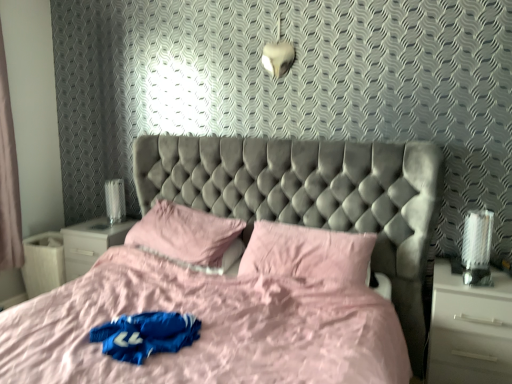
Question: Is white glossy nightstand at lower left, positioned as the first nightstand in left-to-right order, not inside pink fabric curtain at left?

Choices:
 (A) no
 (B) yes

Answer: (B)

Question: Is white glossy nightstand at lower left, positioned as the first nightstand in left-to-right order, positioned in front of pink fabric curtain at left?

Choices:
 (A) no
 (B) yes

Answer: (A)

Question: From the image's perspective, is white glossy nightstand at lower left, acting as the 2th nightstand starting from the front, over pink fabric curtain at left?

Choices:
 (A) no
 (B) yes

Answer: (A)

Question: From a real-world perspective, is white glossy nightstand at lower left, which ranks as the first nightstand in back-to-front order, on pink fabric curtain at left?

Choices:
 (A) no
 (B) yes

Answer: (A)

Question: Is white glossy nightstand at lower left, acting as the 2th nightstand starting from the front, next to pink fabric curtain at left and touching it?

Choices:
 (A) no
 (B) yes

Answer: (A)

Question: Is white glossy nightstand at lower left, which is the 2th nightstand in right-to-left order, wider or thinner than velvet grey bed at center?

Choices:
 (A) wide
 (B) thin

Answer: (B)

Question: From the image's perspective, relative to velvet grey bed at center, is white glossy nightstand at lower left, which ranks as the first nightstand in back-to-front order, above or below?

Choices:
 (A) above
 (B) below

Answer: (A)

Question: Considering the positions of white glossy nightstand at lower left, which is the 2th nightstand in right-to-left order, and velvet grey bed at center in the image, is white glossy nightstand at lower left, which is the 2th nightstand in right-to-left order, bigger or smaller than velvet grey bed at center?

Choices:
 (A) small
 (B) big

Answer: (A)

Question: From a real-world perspective, relative to velvet grey bed at center, is white glossy nightstand at lower left, acting as the 2th nightstand starting from the front, vertically above or below?

Choices:
 (A) below
 (B) above

Answer: (A)

Question: From a real-world perspective, is pink fabric curtain at left above or below white glossy table lamp at left?

Choices:
 (A) above
 (B) below

Answer: (A)

Question: Based on their positions, is pink fabric curtain at left located to the left or right of white glossy table lamp at left?

Choices:
 (A) right
 (B) left

Answer: (B)

Question: Considering their positions, is pink fabric curtain at left located in front of or behind white glossy table lamp at left?

Choices:
 (A) behind
 (B) front

Answer: (B)

Question: From the image's perspective, is pink fabric curtain at left positioned above or below white glossy table lamp at left?

Choices:
 (A) below
 (B) above

Answer: (B)

Question: In terms of size, does white glossy nightstand at lower left, positioned as the first nightstand in left-to-right order, appear bigger or smaller than white glossy nightstand at right, positioned as the second nightstand in left-to-right order?

Choices:
 (A) small
 (B) big

Answer: (A)

Question: Is white glossy nightstand at lower left, which ranks as the first nightstand in back-to-front order, taller or shorter than white glossy nightstand at right, positioned as the second nightstand in left-to-right order?

Choices:
 (A) short
 (B) tall

Answer: (A)